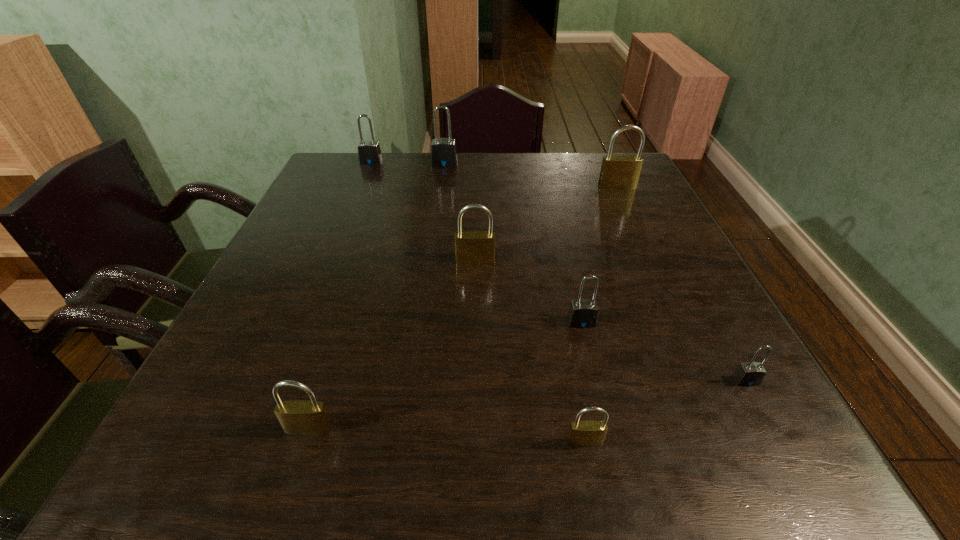
The width and height of the screenshot is (960, 540). Identify the location of the second nearest brass padlock. (301, 417).

The height and width of the screenshot is (540, 960). I want to click on the second smallest brass padlock, so click(301, 417).

Identify the location of the nearest gray padlock. (751, 373).

Where is `the rightmost gray padlock`? the rightmost gray padlock is located at coordinates (751, 373).

Find the location of a particular element. The image size is (960, 540). the third brass padlock from left to right is located at coordinates (581, 433).

Where is `the nearest brass padlock`? the nearest brass padlock is located at coordinates (x=581, y=433).

Where is `free point located on the shackle of the third object from left to right`? The image size is (960, 540). free point located on the shackle of the third object from left to right is located at coordinates (434, 245).

Where is `vacant space located 0.060m on the front-facing side of the sixth nearest padlock`? vacant space located 0.060m on the front-facing side of the sixth nearest padlock is located at coordinates (624, 201).

At what (x,y) coordinates should I click in order to perform the action: click on vacant region located 0.140m on the shackle of the leftmost object. Please return your answer as a coordinate pair (x, y). The image size is (960, 540). Looking at the image, I should click on (361, 188).

Locate an element on the screen. blank space located 0.090m on the front-facing side of the third smallest brass padlock is located at coordinates (475, 292).